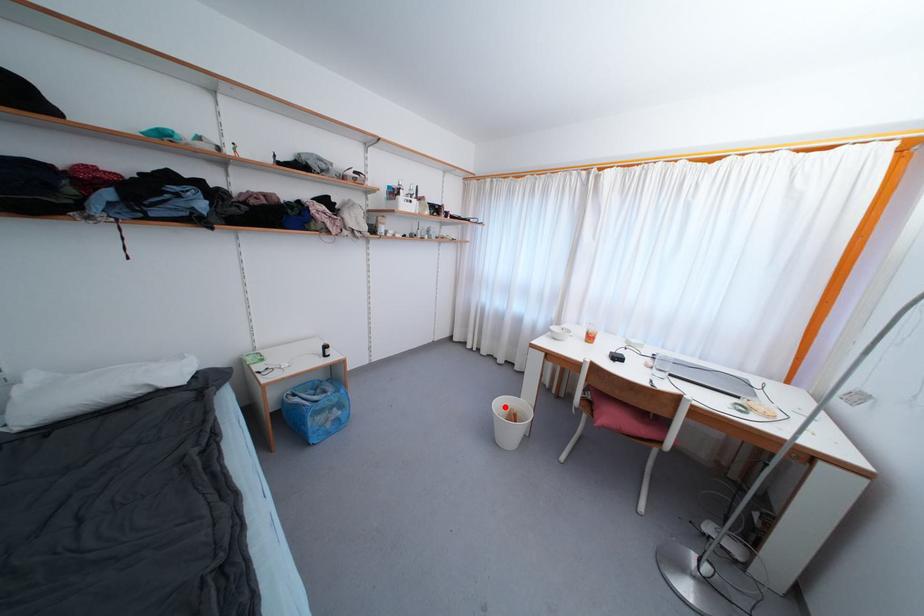
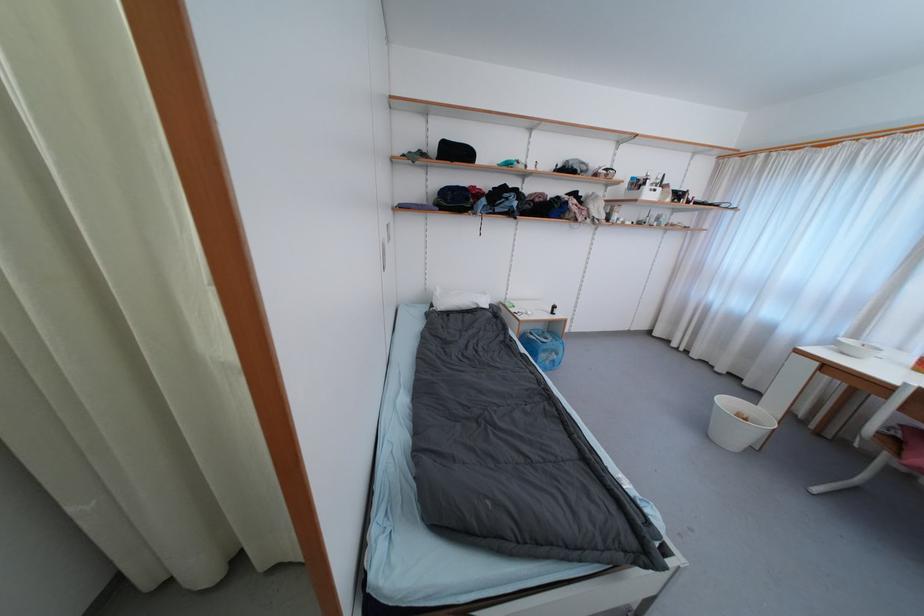
In the second image, find the point that corresponds to the highlighted location in the first image.

(732, 405)